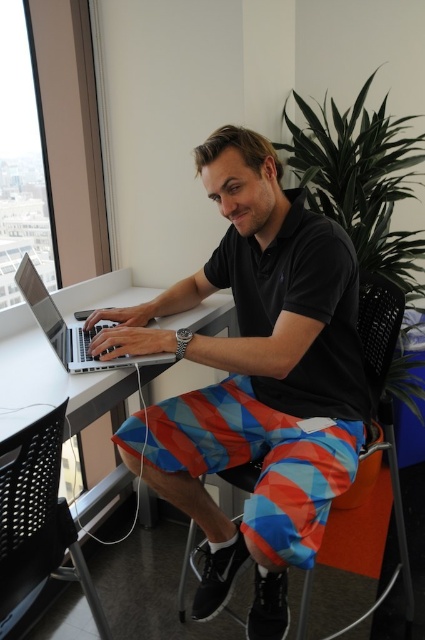
You are an office worker who needs to locate your black mesh chair at lower left. You see the matte black polo shirt at center. Which direction should you move to reach the chair?

The matte black polo shirt at center is to the right of the black mesh chair at lower left, so you should move to your left to reach the chair.

You are a delivery person who needs to place a small package on the desk between the black mesh chair at lower left and the silver metallic laptop at center. Can you estimate if the space between them is wide enough for the package?

The black mesh chair at lower left is much taller than the silver metallic laptop at center, but the description does not provide information about the distance between them. Therefore, it is impossible to determine if the space is wide enough for the package based on the given details.

You are a delivery person entering the office and need to place a package on the desk. Which object, the matte black polo shirt at center or the black mesh chair at lower left, is closer to you so you can place the package there?

The matte black polo shirt at center is closer to you than the black mesh chair at lower left, so you can place the package near the matte black polo shirt at center.